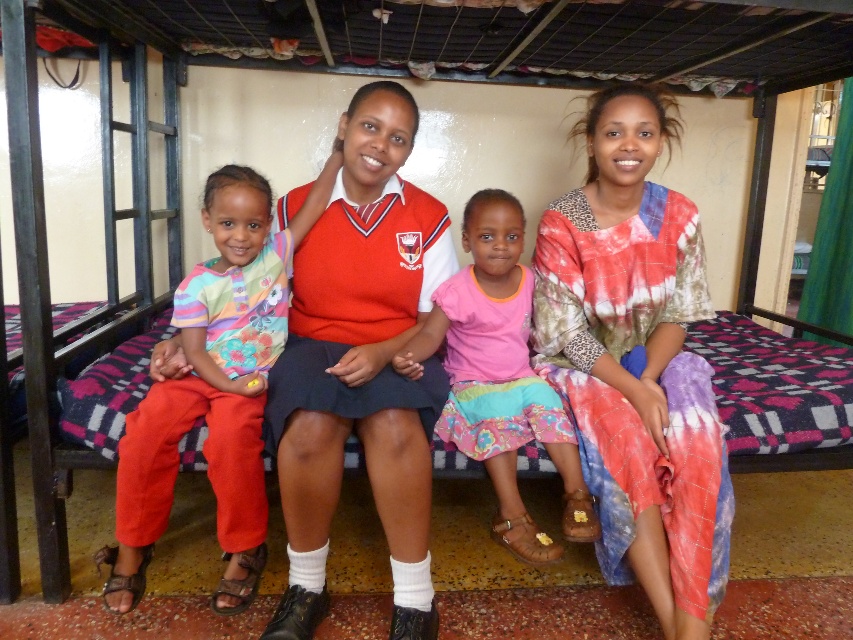
Is point (691, 632) positioned in front of point (575, 538)?

Yes, it is in front of point (575, 538).

Does multicolored tie-dye dress at center have a lesser height compared to pink fabric skirt at center?

No, multicolored tie-dye dress at center is not shorter than pink fabric skirt at center.

Is point (657, 451) positioned behind point (479, 253)?

No.

At what (x,y) coordinates should I click in order to perform the action: click on multicolored tie-dye dress at center. Please return your answer as a coordinate pair (x, y). This screenshot has height=640, width=853. Looking at the image, I should click on (636, 360).

Can you confirm if multicolored tie-dye dress at center is shorter than matte floral shirt at left?

No.

Does multicolored tie-dye dress at center lie behind matte floral shirt at left?

No, it is in front of matte floral shirt at left.

You are a GUI agent. You are given a task and a screenshot of the screen. Output one action in this format:
    pyautogui.click(x=<x>, y=<y>)
    Task: Click on the multicolored tie-dye dress at center
    This screenshot has height=640, width=853.
    Given the screenshot: What is the action you would take?
    pyautogui.click(x=636, y=360)

The height and width of the screenshot is (640, 853). I want to click on multicolored tie-dye dress at center, so click(636, 360).

Locate an element on the screen. matte floral shirt at left is located at coordinates (215, 387).

Which is in front, point (260, 472) or point (434, 317)?

Point (260, 472) is in front.

Between point (219, 378) and point (508, 292), which one is positioned in front?

Positioned in front is point (219, 378).

Locate an element on the screen. The width and height of the screenshot is (853, 640). matte floral shirt at left is located at coordinates (215, 387).